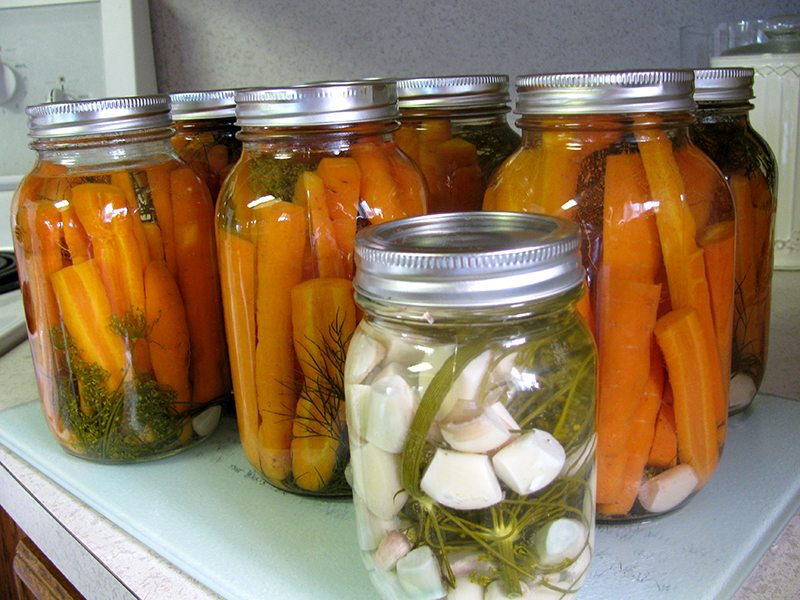
I want to click on glass, so coord(397,500).